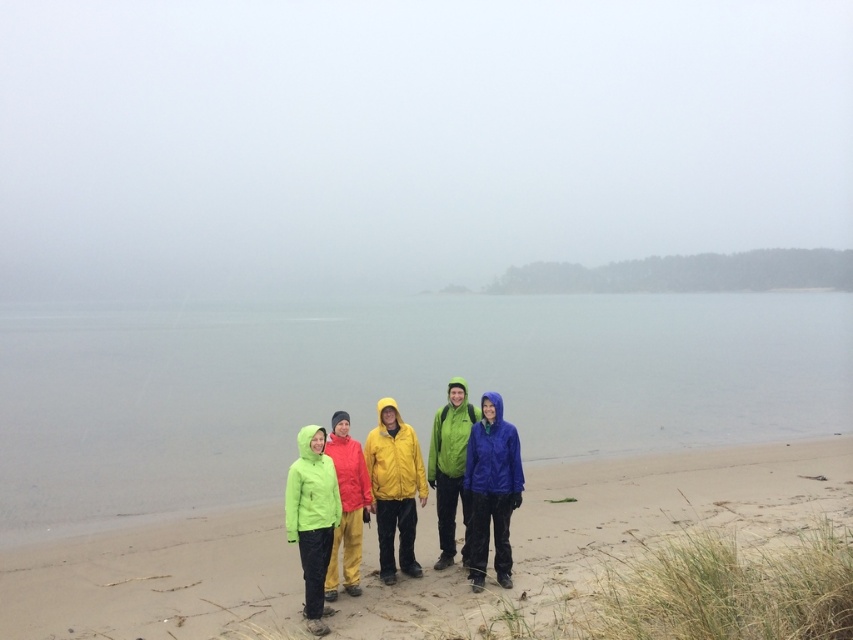
Between point (440, 472) and point (345, 461), which one is positioned behind?

Positioned behind is point (440, 472).

Can you confirm if green matte jacket at center is positioned above matte yellow jacket at center?

Indeed, green matte jacket at center is positioned over matte yellow jacket at center.

Where is `green matte jacket at center`? The height and width of the screenshot is (640, 853). green matte jacket at center is located at coordinates (450, 467).

Image resolution: width=853 pixels, height=640 pixels. Find the location of `green matte jacket at center`. green matte jacket at center is located at coordinates (450, 467).

Which is more to the left, clear water at center or matte yellow jacket at center?

clear water at center is more to the left.

Does clear water at center appear under matte yellow jacket at center?

Actually, clear water at center is above matte yellow jacket at center.

Is point (38, 346) positioned before point (347, 525)?

No, (38, 346) is behind (347, 525).

Identify the location of clear water at center. (390, 387).

Does point (480, 560) come closer to viewer compared to point (345, 540)?

No, (480, 560) is further to viewer.

Between matte blue raincoat at center and matte yellow jacket at center, which one has less height?

Standing shorter between the two is matte yellow jacket at center.

Between point (514, 461) and point (347, 474), which one is positioned behind?

The point (514, 461) is behind.

What are the coordinates of `matte blue raincoat at center` in the screenshot? It's located at (491, 490).